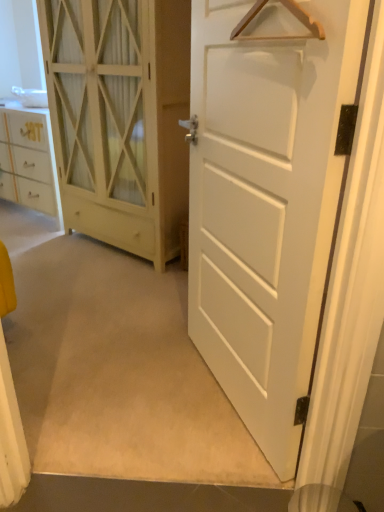
Question: Are white wood cabinet at left, the 2th door viewed from the front, and white matte door at center, which appears as the 1th door when viewed from the front, far apart?

Choices:
 (A) no
 (B) yes

Answer: (B)

Question: Can you confirm if white wood cabinet at left, placed as the first door when sorted from back to front, is positioned to the right of white matte door at center, the second door from the back?

Choices:
 (A) yes
 (B) no

Answer: (B)

Question: From a real-world perspective, is white wood cabinet at left, the 2th door viewed from the front, below white matte door at center, which appears as the 1th door when viewed from the front?

Choices:
 (A) yes
 (B) no

Answer: (B)

Question: Is white wood cabinet at left, the 2th door viewed from the front, next to white matte door at center, which appears as the 1th door when viewed from the front, and touching it?

Choices:
 (A) no
 (B) yes

Answer: (A)

Question: Is white wood cabinet at left, placed as the first door when sorted from back to front, to the left of white matte door at center, the second door from the back, from the viewer's perspective?

Choices:
 (A) no
 (B) yes

Answer: (B)

Question: Can you confirm if white wood cabinet at left, placed as the first door when sorted from back to front, is bigger than white matte door at center, which appears as the 1th door when viewed from the front?

Choices:
 (A) yes
 (B) no

Answer: (A)

Question: From the image's perspective, does wooden hanger at upper center appear higher than white matte door at center, the second door from the back?

Choices:
 (A) no
 (B) yes

Answer: (B)

Question: Is wooden hanger at upper center directly adjacent to white matte door at center, the second door from the back?

Choices:
 (A) no
 (B) yes

Answer: (A)

Question: Can you confirm if wooden hanger at upper center is taller than white matte door at center, the second door from the back?

Choices:
 (A) yes
 (B) no

Answer: (B)

Question: Can you confirm if wooden hanger at upper center is shorter than white matte door at center, which appears as the 1th door when viewed from the front?

Choices:
 (A) yes
 (B) no

Answer: (A)

Question: Is white matte door at center, which appears as the 1th door when viewed from the front, completely or partially inside wooden hanger at upper center?

Choices:
 (A) yes
 (B) no

Answer: (B)

Question: Does wooden hanger at upper center lie in front of white matte door at center, which appears as the 1th door when viewed from the front?

Choices:
 (A) yes
 (B) no

Answer: (A)

Question: Does white wood cabinet at left, the 2th door viewed from the front, come behind wooden hanger at upper center?

Choices:
 (A) yes
 (B) no

Answer: (A)